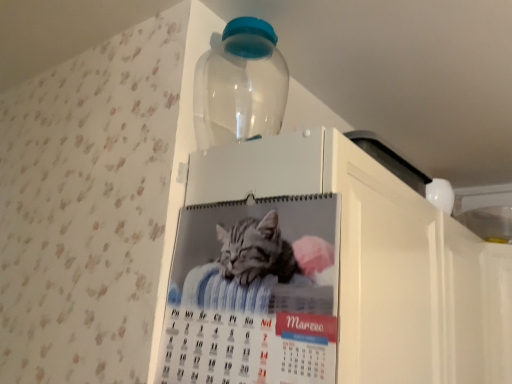
Question: Do you think transparent plastic bottle at upper center is within printed paper calendar at center, or outside of it?

Choices:
 (A) outside
 (B) inside

Answer: (A)

Question: In the image, is transparent plastic bottle at upper center on the left side or the right side of printed paper calendar at center?

Choices:
 (A) right
 (B) left

Answer: (A)

Question: Estimate the real-world distances between objects in this image. Which object is closer to the transparent plastic bottle at upper center?

Choices:
 (A) white glossy calendar at upper center
 (B) printed paper calendar at center

Answer: (A)

Question: Estimate the real-world distances between objects in this image. Which object is farther from the printed paper calendar at center?

Choices:
 (A) transparent plastic bottle at upper center
 (B) white glossy calendar at upper center

Answer: (A)